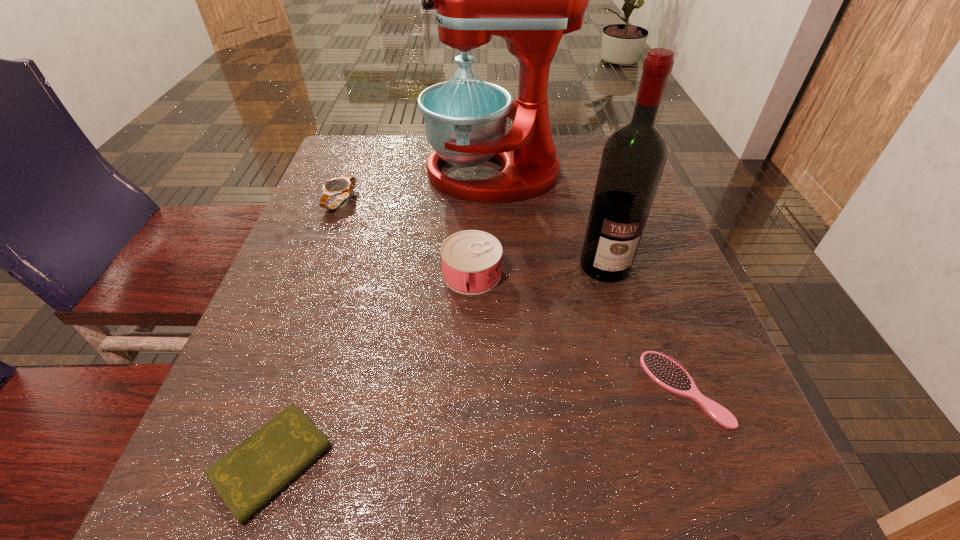
Locate an element on the screen. mixer is located at coordinates (531, 0).

Where is `alcohol`? This screenshot has height=540, width=960. alcohol is located at coordinates (633, 158).

This screenshot has height=540, width=960. Find the location of `the third tallest object`. the third tallest object is located at coordinates (471, 260).

Locate an element on the screen. The height and width of the screenshot is (540, 960). watch is located at coordinates (343, 186).

Image resolution: width=960 pixels, height=540 pixels. I want to click on hairbrush, so click(x=666, y=372).

The height and width of the screenshot is (540, 960). What are the coordinates of `diary` in the screenshot? It's located at (250, 475).

You are a GUI agent. You are given a task and a screenshot of the screen. Output one action in this format:
    pyautogui.click(x=<x>, y=<y>)
    Task: Click on the vacant space located on the front-facing side of the mixer
    
    Given the screenshot: What is the action you would take?
    pyautogui.click(x=368, y=173)

Find the location of `free space located 0.050m on the front-facing side of the mixer`. free space located 0.050m on the front-facing side of the mixer is located at coordinates (404, 173).

This screenshot has height=540, width=960. I want to click on free spot located 0.230m on the front-facing side of the mixer, so click(x=331, y=173).

This screenshot has height=540, width=960. I want to click on vacant region located 0.120m on the front and back of the alcohol, so click(x=625, y=336).